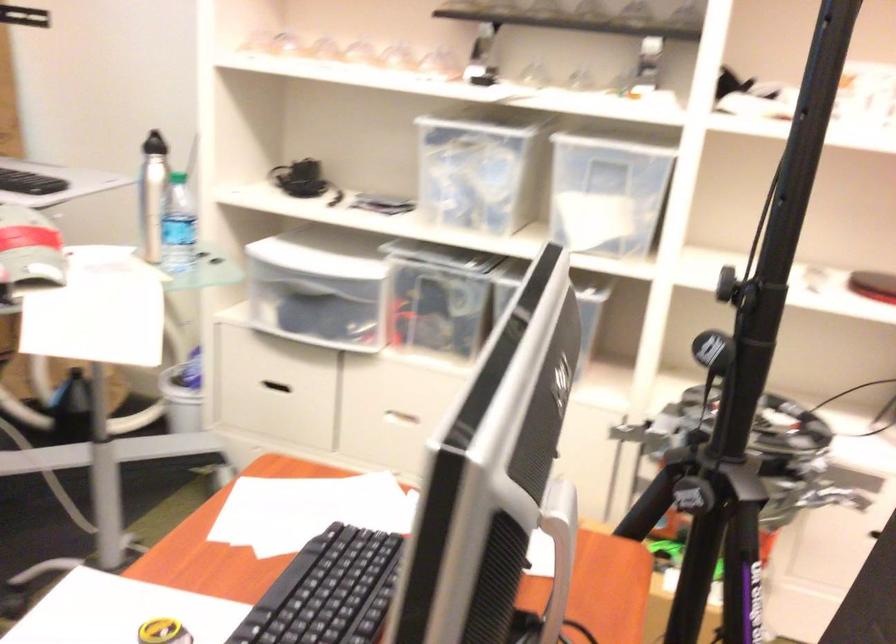
What do you see at coordinates (177, 225) in the screenshot?
I see `the clear water bottle` at bounding box center [177, 225].